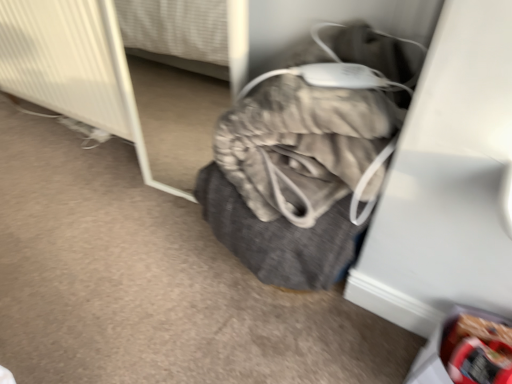
The width and height of the screenshot is (512, 384). Identify the location of white plastic radiator at left. coord(62,61).

What do you see at coordinates (62, 61) in the screenshot? I see `white plastic radiator at left` at bounding box center [62, 61].

In order to click on white plastic radiator at left in this screenshot , I will do `click(62, 61)`.